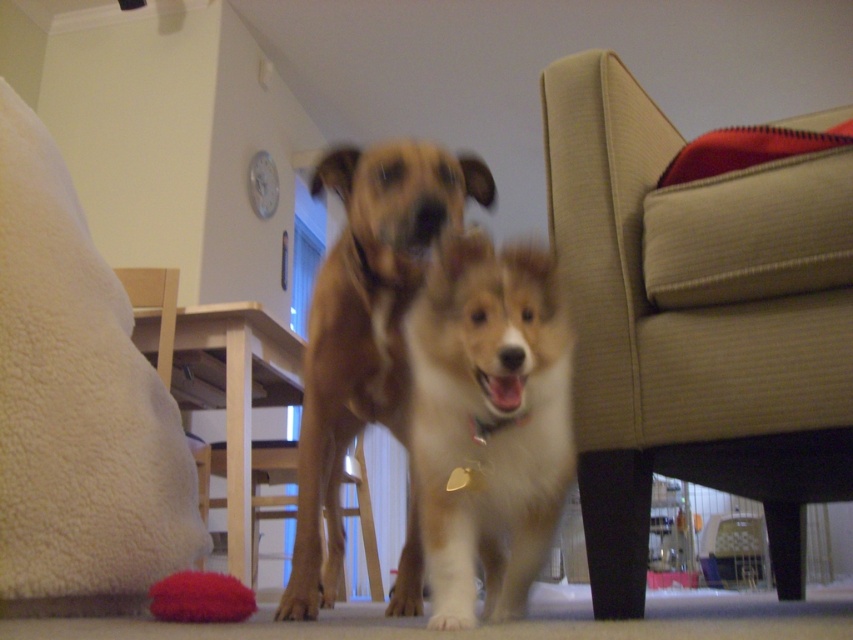
You are standing in the living room and want to place a small potted plant exactly where the fuzzy brown dog at center is currently standing. Based on the scene description, where should you place the potted plant?

You should place the potted plant at the 2D coordinates point (485, 428) where the fuzzy brown dog at center is located.